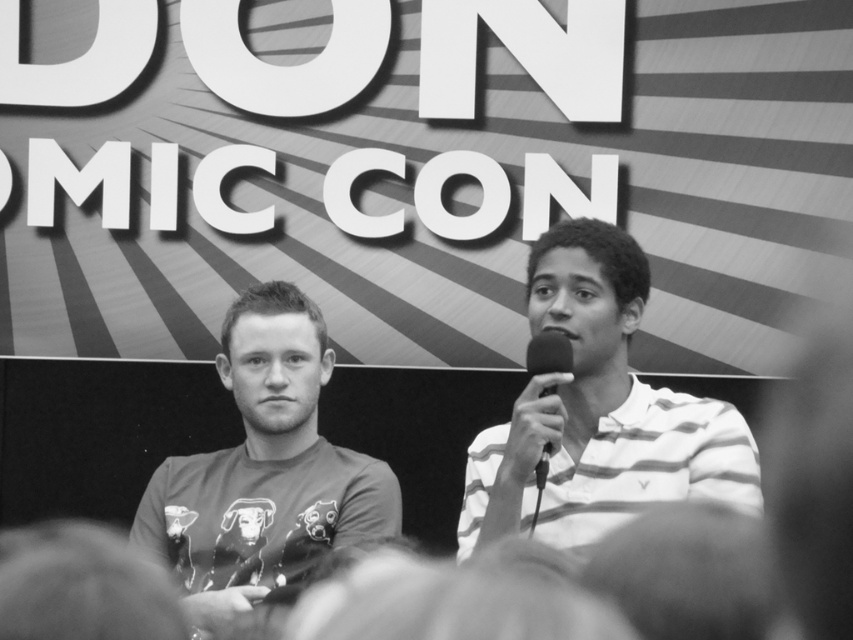
From the picture: Is striped cotton shirt at right shorter than matte gray t-shirt at center?

No, striped cotton shirt at right is not shorter than matte gray t-shirt at center.

Is point (596, 241) less distant than point (285, 356)?

That is True.

The width and height of the screenshot is (853, 640). What are the coordinates of `striped cotton shirt at right` in the screenshot? It's located at point(598,412).

Between matte gray t-shirt at center and metallic silver microphone at center, which one appears on the right side from the viewer's perspective?

metallic silver microphone at center is more to the right.

You are a GUI agent. You are given a task and a screenshot of the screen. Output one action in this format:
    pyautogui.click(x=<x>, y=<y>)
    Task: Click on the matte gray t-shirt at center
    This screenshot has height=640, width=853.
    Given the screenshot: What is the action you would take?
    pyautogui.click(x=264, y=468)

Which is behind, point (279, 552) or point (550, 369)?

The point (279, 552) is more distant.

In order to click on matte gray t-shirt at center in this screenshot , I will do 264,468.

Looking at this image, can you confirm if striped cotton shirt at right is positioned to the left of metallic silver microphone at center?

Incorrect, striped cotton shirt at right is not on the left side of metallic silver microphone at center.

Does point (675, 483) come closer to viewer compared to point (547, 356)?

No, it is behind (547, 356).

Is point (590, 525) positioned in front of point (541, 451)?

No, (590, 525) is behind (541, 451).

Locate an element on the screen. striped cotton shirt at right is located at coordinates (598, 412).